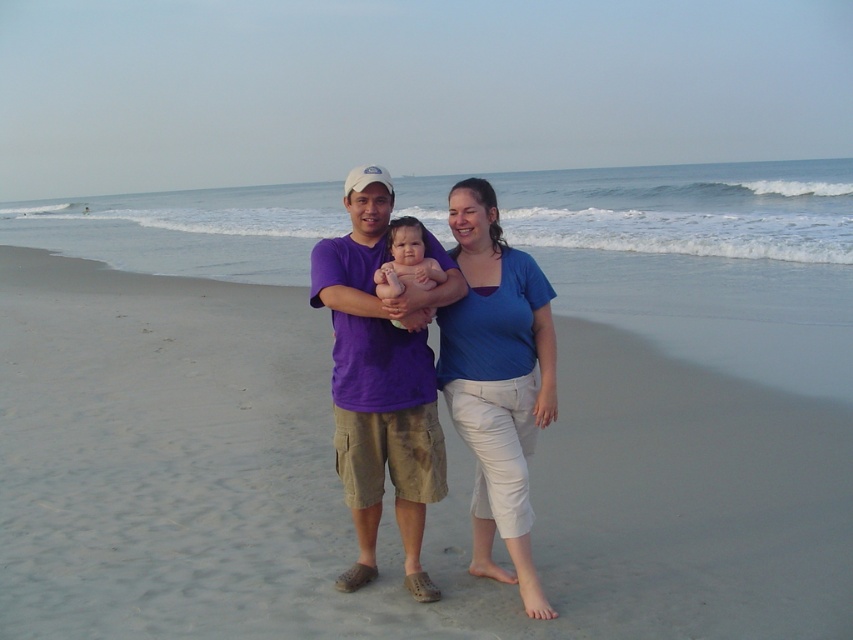
Question: Which object is farther from the camera taking this photo?

Choices:
 (A) soft pink skin at center
 (B) smooth sand at center
 (C) blue cotton shirt at center

Answer: (C)

Question: Which object is positioned closest to the purple cotton t-shirt at center?

Choices:
 (A) smooth sand at center
 (B) blue cotton shirt at center
 (C) soft pink skin at center

Answer: (B)

Question: Which point is closer to the camera?

Choices:
 (A) (395, 356)
 (B) (401, 253)
 (C) (433, 339)
 (D) (529, 340)

Answer: (B)

Question: Does smooth sand at center have a lesser width compared to blue cotton shirt at center?

Choices:
 (A) yes
 (B) no

Answer: (B)

Question: Can you confirm if purple cotton t-shirt at center is bigger than blue cotton shirt at center?

Choices:
 (A) yes
 (B) no

Answer: (A)

Question: Can you confirm if purple cotton t-shirt at center is positioned to the left of blue cotton shirt at center?

Choices:
 (A) yes
 (B) no

Answer: (A)